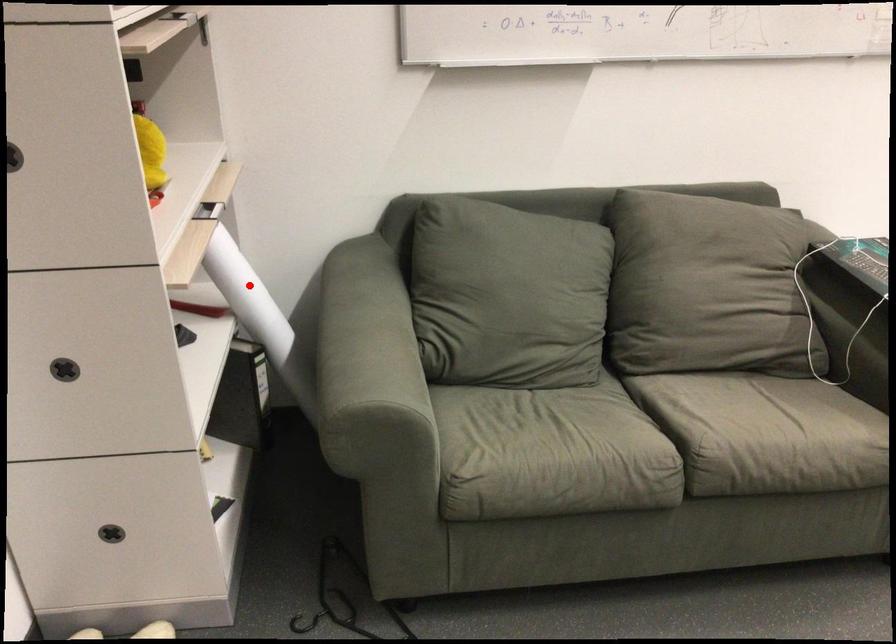
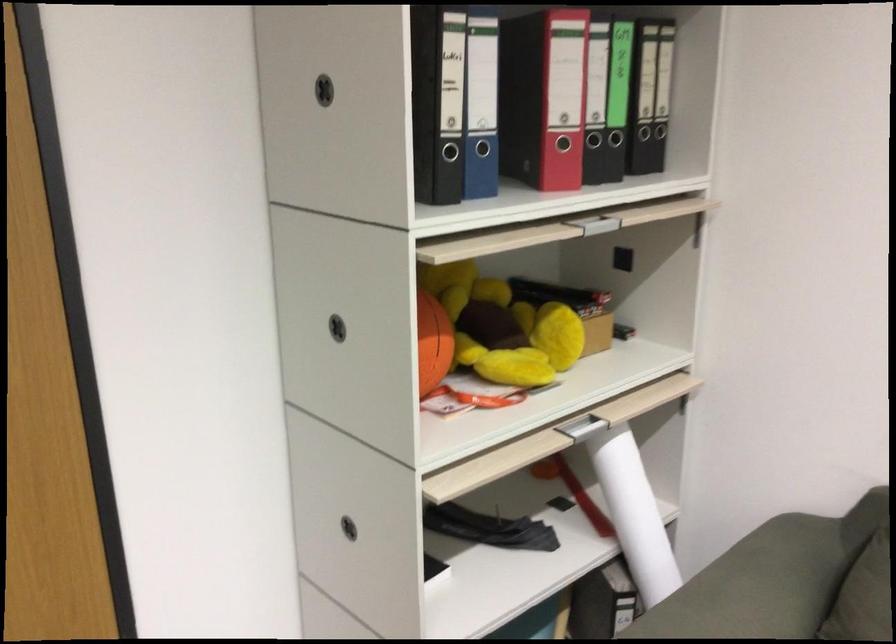
Locate, in the second image, the point that corresponds to the highlighted location in the first image.

(633, 514)